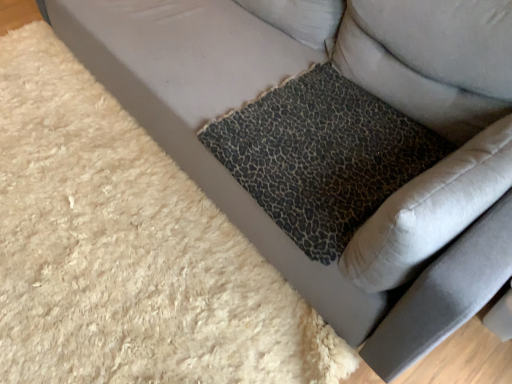
Question: Does leopard print fabric pillow at upper right appear on the left side of leopard print fabric cushion at center?

Choices:
 (A) yes
 (B) no

Answer: (B)

Question: From a real-world perspective, is leopard print fabric pillow at upper right over leopard print fabric cushion at center?

Choices:
 (A) yes
 (B) no

Answer: (A)

Question: Considering the relative positions of leopard print fabric pillow at upper right and leopard print fabric cushion at center in the image provided, is leopard print fabric pillow at upper right behind leopard print fabric cushion at center?

Choices:
 (A) no
 (B) yes

Answer: (A)

Question: Is leopard print fabric cushion at center surrounded by leopard print fabric pillow at upper right?

Choices:
 (A) no
 (B) yes

Answer: (A)

Question: Considering the relative sizes of leopard print fabric pillow at upper right and leopard print fabric cushion at center in the image provided, is leopard print fabric pillow at upper right thinner than leopard print fabric cushion at center?

Choices:
 (A) yes
 (B) no

Answer: (A)

Question: Is leopard print fabric pillow at upper right wider than leopard print fabric cushion at center?

Choices:
 (A) no
 (B) yes

Answer: (A)

Question: Is leopard print cushion at lower right closer to camera compared to leopard print fabric cushion at center?

Choices:
 (A) yes
 (B) no

Answer: (A)

Question: Considering the relative positions of leopard print cushion at lower right and leopard print fabric cushion at center in the image provided, is leopard print cushion at lower right to the right of leopard print fabric cushion at center from the viewer's perspective?

Choices:
 (A) no
 (B) yes

Answer: (B)

Question: Is leopard print cushion at lower right positioned far away from leopard print fabric cushion at center?

Choices:
 (A) no
 (B) yes

Answer: (A)

Question: Is leopard print cushion at lower right facing away from leopard print fabric cushion at center?

Choices:
 (A) yes
 (B) no

Answer: (A)

Question: Is leopard print cushion at lower right facing towards leopard print fabric cushion at center?

Choices:
 (A) no
 (B) yes

Answer: (A)

Question: Is leopard print cushion at lower right placed right next to leopard print fabric cushion at center?

Choices:
 (A) yes
 (B) no

Answer: (B)

Question: Is leopard print fabric pillow at upper right turned away from leopard print cushion at lower right?

Choices:
 (A) no
 (B) yes

Answer: (A)